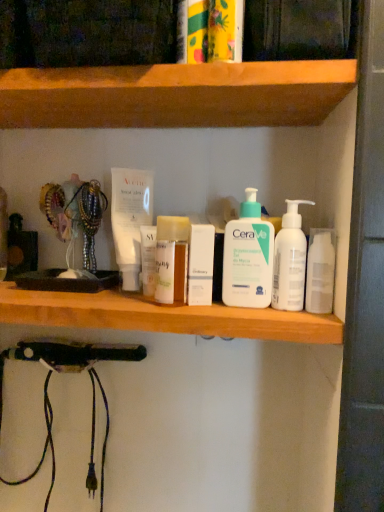
Identify the location of vacant space underneath wooden at upper center, the first shelf positioned from the top (from a real-world perspective). This screenshot has height=512, width=384. (104, 293).